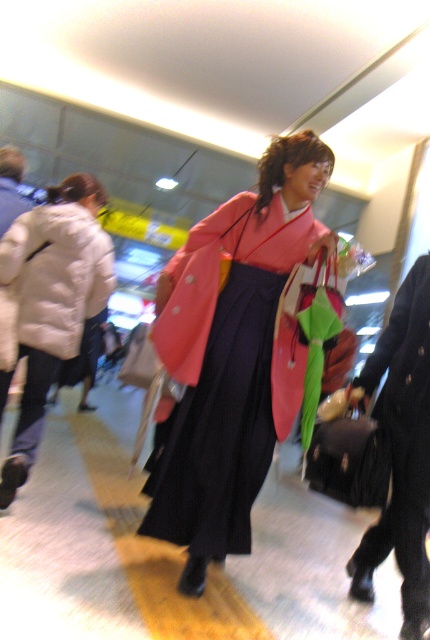
Question: Considering the real-world distances, which object is closest to the white puffy coat at left?

Choices:
 (A) velvet black robe at lower right
 (B) white matte jacket at left

Answer: (B)

Question: Does white matte jacket at left appear under white puffy coat at left?

Choices:
 (A) no
 (B) yes

Answer: (B)

Question: Among these points, which one is nearest to the camera?

Choices:
 (A) (258, 307)
 (B) (43, 320)
 (C) (418, 540)
 (D) (20, 342)

Answer: (C)

Question: Estimate the real-world distances between objects in this image. Which object is farther from the velvet black robe at lower right?

Choices:
 (A) pink satin kimono at center
 (B) white matte jacket at left

Answer: (B)

Question: Is pink satin kimono at center to the left of velvet black robe at lower right from the viewer's perspective?

Choices:
 (A) no
 (B) yes

Answer: (B)

Question: Can you confirm if velvet black robe at lower right is positioned to the right of white puffy coat at left?

Choices:
 (A) no
 (B) yes

Answer: (B)